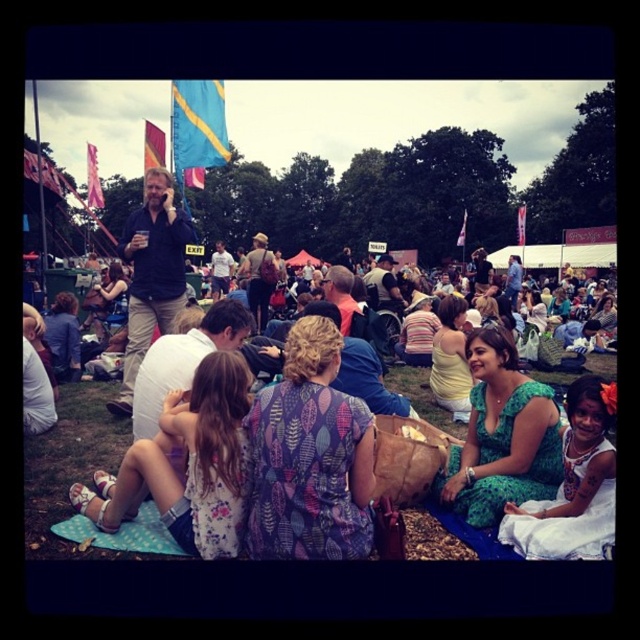
You are standing at the edge of the gathering and want to reach the dark blue shirt at center without stepping on the printed fabric blanket at center. Is this possible?

The printed fabric blanket at center is in front of the dark blue shirt at center, so you would have to step over or around the blanket to reach the shirt without stepping on it.

You are a photographer standing in the middle of the gathering and want to take a photo of the blue fabric flag at upper center and the matte brown backpack at center. Which object will appear closer to you in the photo?

The blue fabric flag at upper center will appear closer in the photo because it is further to the viewer than the matte brown backpack at center, meaning it is nearer to your position as the photographer.

You are at the gathering and want to place a small picnic basket on the printed fabric blanket at center without it falling off. Considering the dark blue shirt at center is nearby, which object should you place the basket closer to for stability?

The printed fabric blanket at center has a lesser height compared to dark blue shirt at center, so placing the basket closer to the dark blue shirt at center would provide a more stable base as it is taller and less likely to tip over.